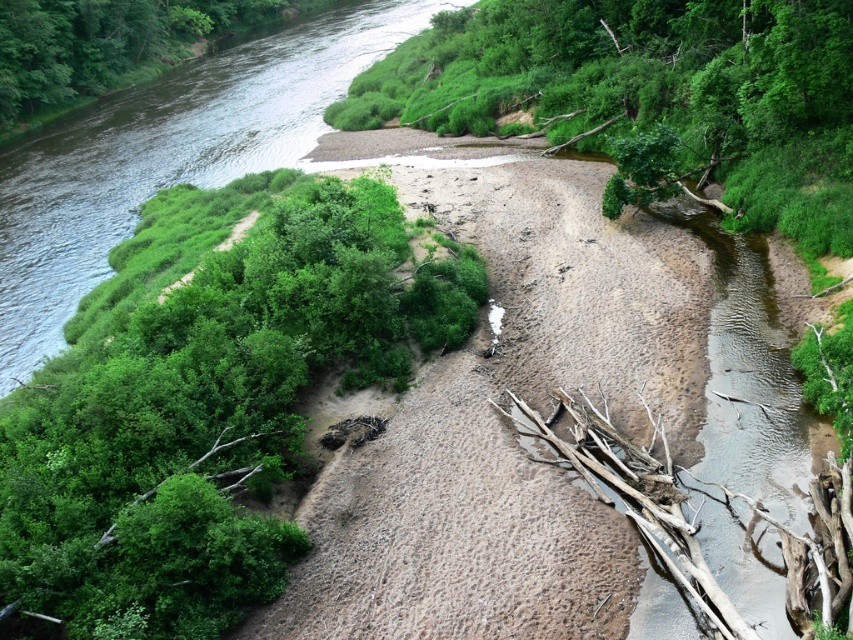
Question: Is green leafy shrub at center-left thinner than green leafy vegetation at upper left?

Choices:
 (A) no
 (B) yes

Answer: (B)

Question: Does green leafy shrub at center-left have a greater width compared to green leafy vegetation at upper left?

Choices:
 (A) no
 (B) yes

Answer: (A)

Question: Which of these objects is positioned closest to the green leafy shrub at center-left?

Choices:
 (A) green leafy tree at upper left
 (B) green leafy vegetation at upper left

Answer: (B)

Question: From the image, what is the correct spatial relationship of green leafy vegetation at upper left in relation to green leafy tree at upper left?

Choices:
 (A) left
 (B) right

Answer: (B)

Question: Among these objects, which one is farthest from the camera?

Choices:
 (A) green leafy vegetation at upper left
 (B) green leafy shrub at center-left

Answer: (A)

Question: Which point is farther to the camera?

Choices:
 (A) (166, 36)
 (B) (73, 164)

Answer: (A)